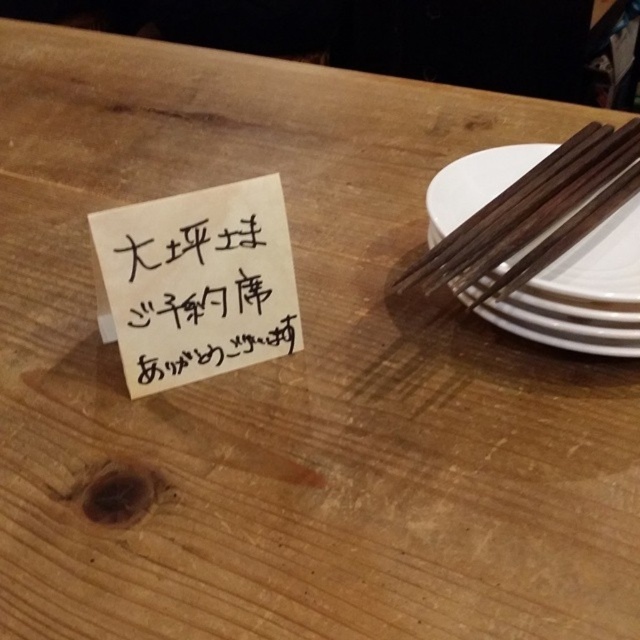
From the picture: Who is positioned more to the right, white paper at upper left or white glossy plate at right?

Positioned to the right is white glossy plate at right.

Is white paper at upper left thinner than white glossy plate at right?

Correct, white paper at upper left's width is less than white glossy plate at right's.

Between point (237, 243) and point (616, 296), which one is positioned behind?

Point (237, 243)

This screenshot has width=640, height=640. Identify the location of white paper at upper left. (196, 291).